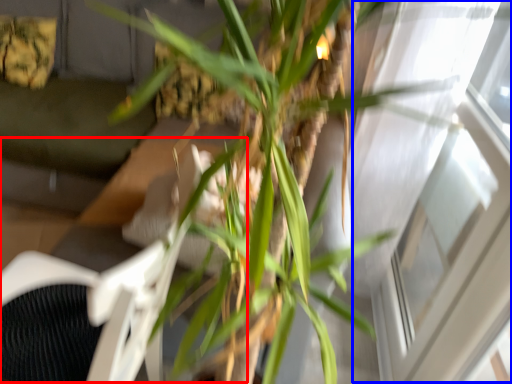
Question: Which point is further to the camera, swivel chair (highlighted by a red box) or window (highlighted by a blue box)?

Choices:
 (A) swivel chair
 (B) window

Answer: (B)